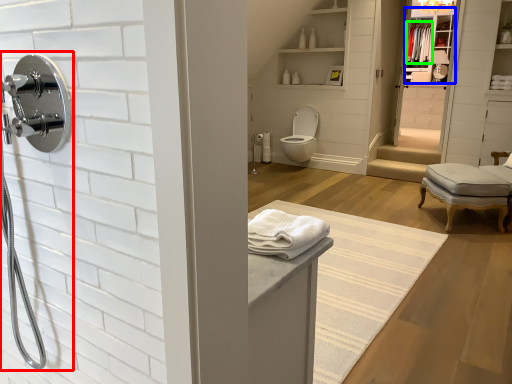
Question: Estimate the real-world distances between objects in this image. Which object is farther from shower (highlighted by a red box), medicine cabinet (highlighted by a blue box) or bath towel (highlighted by a green box)?

Choices:
 (A) medicine cabinet
 (B) bath towel

Answer: (B)